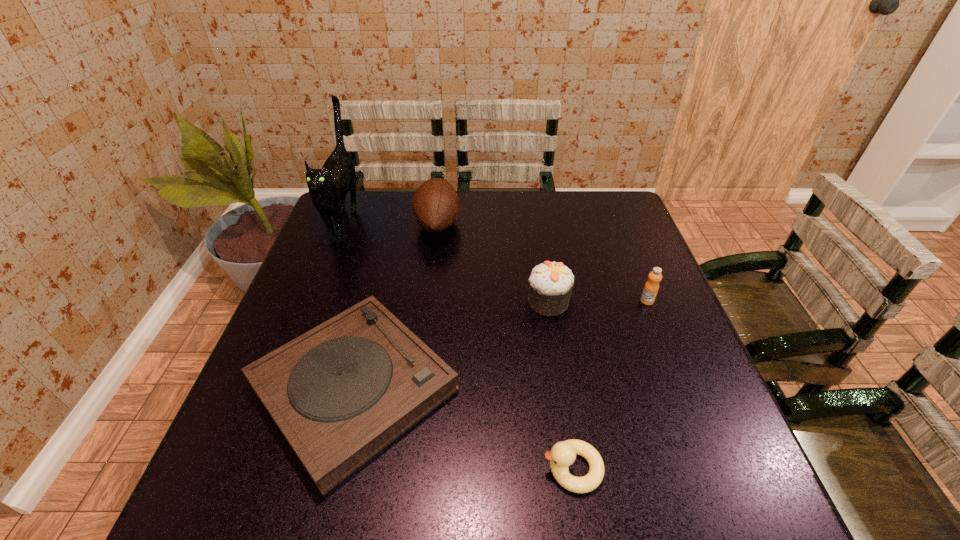
This screenshot has height=540, width=960. In order to click on cat in this screenshot , I will do `click(328, 187)`.

At what (x,y) coordinates should I click in order to perform the action: click on the second tallest object. Please return your answer as a coordinate pair (x, y). This screenshot has width=960, height=540. Looking at the image, I should click on (436, 206).

Find the location of `cupcake`. cupcake is located at coordinates (550, 284).

Find the location of `the rightmost object`. the rightmost object is located at coordinates [651, 287].

Locate an element on the screen. The image size is (960, 540). duckling is located at coordinates (563, 454).

Locate an element on the screen. This screenshot has width=960, height=540. phonograph record is located at coordinates (340, 393).

Locate an element on the screen. blank space located 0.320m on the face of the tallest object is located at coordinates 298,339.

Where is `free location located 0.130m on the laces of the football`? The width and height of the screenshot is (960, 540). free location located 0.130m on the laces of the football is located at coordinates (502, 224).

Identify the location of blank area located on the back of the cupcake. (535, 219).

Locate an element on the screen. The width and height of the screenshot is (960, 540). vacant space positioned 0.170m on the front label of the rightmost object is located at coordinates pos(670,360).